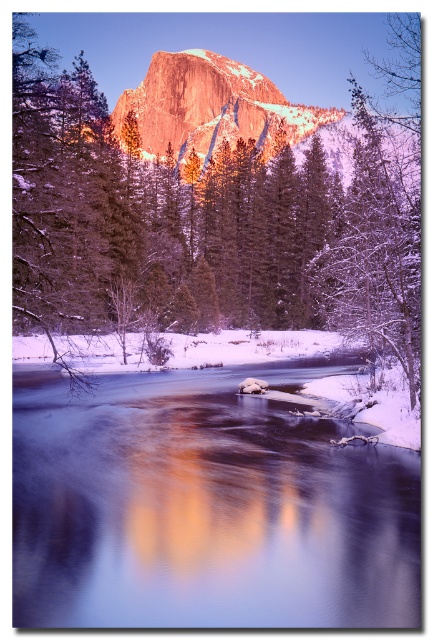
Can you confirm if smooth ice stream at lower center is positioned below snow-covered tree at right?

Yes.

Is smooth ice stream at lower center further to camera compared to snow-covered tree at right?

No, smooth ice stream at lower center is in front of snow-covered tree at right.

Describe the element at coordinates (206, 508) in the screenshot. I see `smooth ice stream at lower center` at that location.

Image resolution: width=433 pixels, height=640 pixels. I want to click on smooth ice stream at lower center, so click(206, 508).

Is snowy evergreen tree at center positioned behind smooth ice stream at lower center?

Yes, snowy evergreen tree at center is further from the viewer.

Is point (238, 120) positioned before point (219, 512)?

No, it is not.

The width and height of the screenshot is (433, 640). What are the coordinates of `snowy evergreen tree at center` in the screenshot? It's located at (206, 211).

Who is lower down, snow-covered tree at right or shiny granite mountain at center?

shiny granite mountain at center

Where is `snow-covered tree at right`? This screenshot has height=640, width=433. snow-covered tree at right is located at coordinates (381, 220).

The height and width of the screenshot is (640, 433). Describe the element at coordinates (381, 220) in the screenshot. I see `snow-covered tree at right` at that location.

Identify the location of snow-covered tree at right. (381, 220).